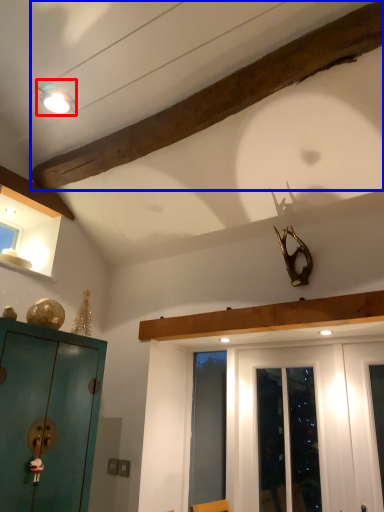
Question: Which object appears closest to the camera in this image, light fixture (highlighted by a red box) or molding (highlighted by a blue box)?

Choices:
 (A) light fixture
 (B) molding

Answer: (B)